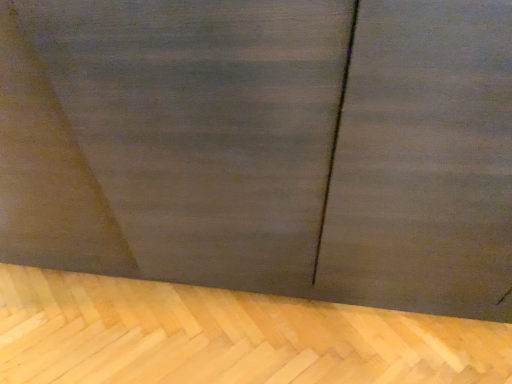
Describe the element at coordinates (227, 337) in the screenshot. I see `light wood plywood at lower center` at that location.

At what (x,y) coordinates should I click in order to perform the action: click on light wood plywood at lower center. Please return your answer as a coordinate pair (x, y). The width and height of the screenshot is (512, 384). Looking at the image, I should click on (227, 337).

This screenshot has height=384, width=512. What are the coordinates of `light wood plywood at lower center` in the screenshot? It's located at (227, 337).